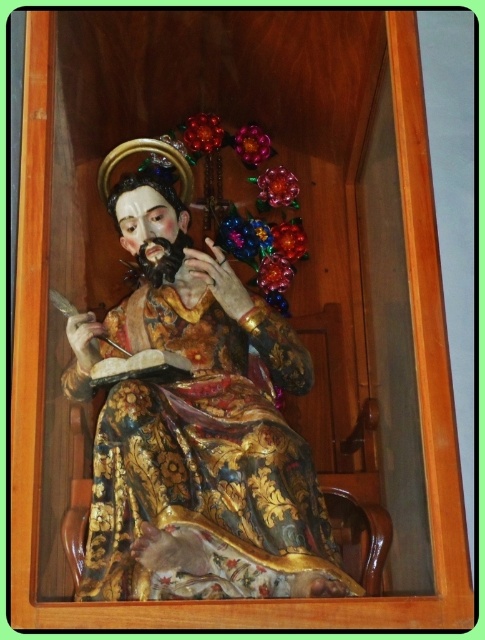
Question: From the image, what is the correct spatial relationship of gold-painted wood statue at center in relation to matte gold face at center?

Choices:
 (A) below
 (B) above

Answer: (A)

Question: Among these points, which one is nearest to the camera?

Choices:
 (A) (154, 246)
 (B) (323, 572)

Answer: (B)

Question: From the image, what is the correct spatial relationship of gold-painted wood statue at center in relation to matte gold face at center?

Choices:
 (A) below
 (B) above

Answer: (A)

Question: Can you confirm if gold-painted wood statue at center is smaller than matte gold face at center?

Choices:
 (A) no
 (B) yes

Answer: (A)

Question: Which of the following is the farthest from the observer?

Choices:
 (A) (116, 528)
 (B) (131, 192)

Answer: (B)